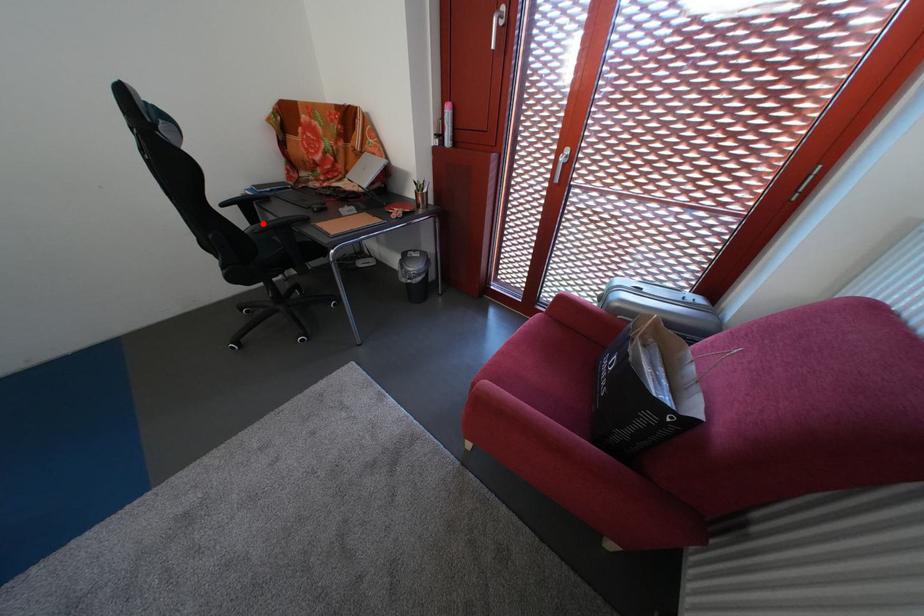
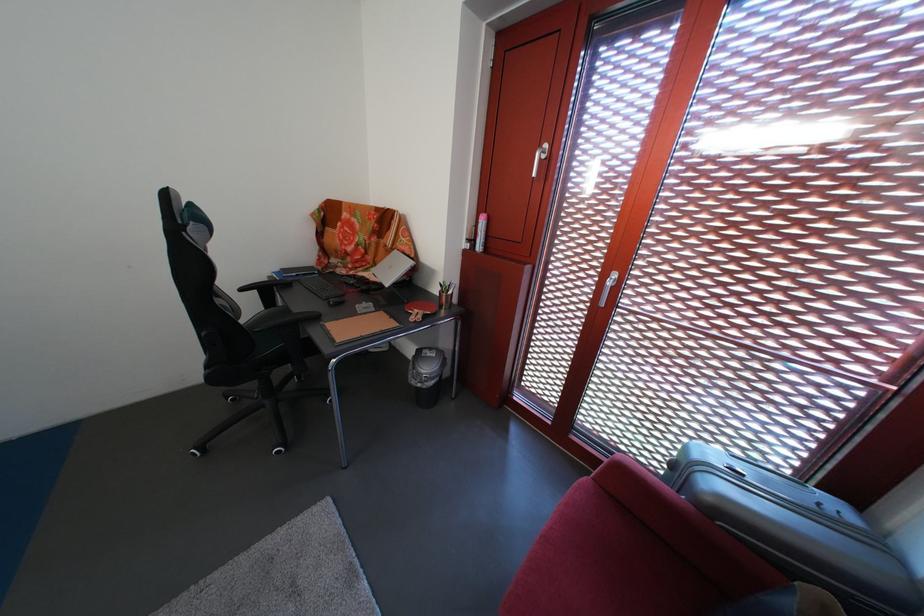
Where in the second image is the point corresponding to the highlighted location from the first image?

(280, 308)